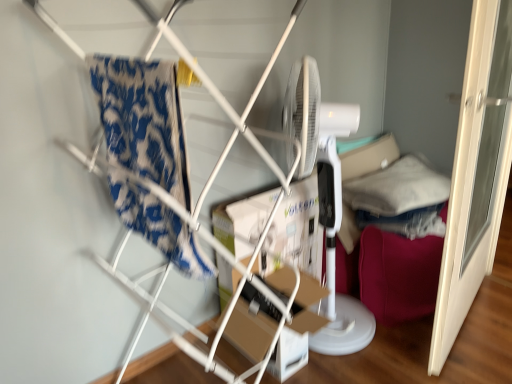
Question: Should I look upward or downward to see cardboard box at center?

Choices:
 (A) down
 (B) up

Answer: (A)

Question: Does blue patterned fabric at left lie in front of white plastic mechanical fan at right?

Choices:
 (A) no
 (B) yes

Answer: (B)

Question: Is blue patterned fabric at left further to camera compared to white plastic mechanical fan at right?

Choices:
 (A) no
 (B) yes

Answer: (A)

Question: Is blue patterned fabric at left directly adjacent to white plastic mechanical fan at right?

Choices:
 (A) yes
 (B) no

Answer: (B)

Question: Does blue patterned fabric at left have a lesser width compared to white plastic mechanical fan at right?

Choices:
 (A) no
 (B) yes

Answer: (A)

Question: Is blue patterned fabric at left to the left of white plastic mechanical fan at right from the viewer's perspective?

Choices:
 (A) yes
 (B) no

Answer: (A)

Question: From a real-world perspective, is blue patterned fabric at left on white plastic mechanical fan at right?

Choices:
 (A) no
 (B) yes

Answer: (B)

Question: Is velvet pink bean bag chair at right thinner than blue patterned fabric at left?

Choices:
 (A) yes
 (B) no

Answer: (A)

Question: Can you confirm if velvet pink bean bag chair at right is taller than blue patterned fabric at left?

Choices:
 (A) no
 (B) yes

Answer: (A)

Question: From a real-world perspective, is velvet pink bean bag chair at right beneath blue patterned fabric at left?

Choices:
 (A) yes
 (B) no

Answer: (A)

Question: From the image's perspective, does velvet pink bean bag chair at right appear lower than blue patterned fabric at left?

Choices:
 (A) no
 (B) yes

Answer: (B)

Question: Can you confirm if velvet pink bean bag chair at right is shorter than blue patterned fabric at left?

Choices:
 (A) yes
 (B) no

Answer: (A)

Question: From the image's perspective, is velvet pink bean bag chair at right over blue patterned fabric at left?

Choices:
 (A) no
 (B) yes

Answer: (A)

Question: From the image's perspective, is soft white pillow at right located beneath white plastic mechanical fan at right?

Choices:
 (A) no
 (B) yes

Answer: (A)